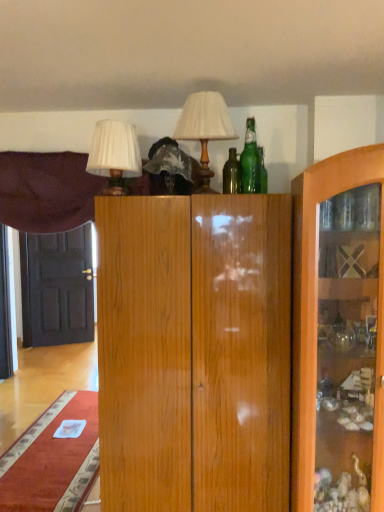
You are a GUI agent. You are given a task and a screenshot of the screen. Output one action in this format:
    pyautogui.click(x=<x>, y=<y>)
    Task: Click on the white pleated shade at upper left, which is the 2th table lamp from right to left
    Image resolution: width=384 pixels, height=512 pixels.
    Given the screenshot: What is the action you would take?
    pyautogui.click(x=114, y=154)

In order to face white pleated shade at upper left, which is the 2th table lamp from right to left, should I rotate leftwards or rightwards?

Rotate left and turn 10.356 degrees.

At what (x,y) coordinates should I click in order to perform the action: click on green glass bottle at upper center. Please return your answer as a coordinate pair (x, y). The image size is (384, 512). Looking at the image, I should click on (250, 161).

Where is `velvet purple curtain at upper left`? velvet purple curtain at upper left is located at coordinates (47, 191).

Is green glass bottle at upper center completely or partially outside of black glossy door at left?

green glass bottle at upper center is positioned outside black glossy door at left.

Does green glass bottle at upper center appear on the left side of black glossy door at left?

No.

Is green glass bottle at upper center turned away from black glossy door at left?

No, green glass bottle at upper center's orientation is not away from black glossy door at left.

Consider the image. Who is bigger, green glass bottle at upper center or black glossy door at left?

black glossy door at left is bigger.

Can you confirm if velvet purple curtain at upper left is taller than matte white lampshade at upper center, arranged as the 2th table lamp when viewed from the left?

Yes, velvet purple curtain at upper left is taller than matte white lampshade at upper center, arranged as the 2th table lamp when viewed from the left.

At what (x,y) coordinates should I click in order to perform the action: click on curtain lying on the left of matte white lampshade at upper center, arranged as the 2th table lamp when viewed from the left. Please return your answer as a coordinate pair (x, y). The width and height of the screenshot is (384, 512). Looking at the image, I should click on (47, 191).

From a real-world perspective, is velvet purple curtain at upper left positioned above or below matte white lampshade at upper center, arranged as the 2th table lamp when viewed from the left?

velvet purple curtain at upper left is below matte white lampshade at upper center, arranged as the 2th table lamp when viewed from the left.

Is point (197, 132) farther from viewer compared to point (247, 133)?

No, it is not.

Considering the relative positions of matte white lampshade at upper center, the 1th table lamp positioned from the right, and green glass bottle at upper center in the image provided, is matte white lampshade at upper center, the 1th table lamp positioned from the right, in front of green glass bottle at upper center?

Yes, matte white lampshade at upper center, the 1th table lamp positioned from the right, is closer to the camera.

In the image, there is a green glass bottle at upper center. Where is `table lamp above it (from the image's perspective)`? Image resolution: width=384 pixels, height=512 pixels. table lamp above it (from the image's perspective) is located at coordinates (204, 128).

How far apart are matte white lampshade at upper center, arranged as the 2th table lamp when viewed from the left, and green glass bottle at upper center?

They are 7.85 inches apart.

Is white pleated shade at upper left, which appears as the first table lamp when viewed from the left, bigger than green glass bottle at upper center?

Indeed, white pleated shade at upper left, which appears as the first table lamp when viewed from the left, has a larger size compared to green glass bottle at upper center.

At what (x,y) coordinates should I click in order to perform the action: click on bottle above the white pleated shade at upper left, which is the 2th table lamp from right to left (from the image's perspective). Please return your answer as a coordinate pair (x, y). This screenshot has height=512, width=384. Looking at the image, I should click on 250,161.

Which point is more forward, (134,148) or (252,152)?

Point (252,152)

From the picture: Relative to green glass bottle at upper center, is white pleated shade at upper left, which appears as the first table lamp when viewed from the left, in front or behind?

Clearly, white pleated shade at upper left, which appears as the first table lamp when viewed from the left, is in front of green glass bottle at upper center.

Measure the distance from matte white lampshade at upper center, arranged as the 2th table lamp when viewed from the left, to white pleated shade at upper left, which appears as the first table lamp when viewed from the left.

A distance of 12.54 inches exists between matte white lampshade at upper center, arranged as the 2th table lamp when viewed from the left, and white pleated shade at upper left, which appears as the first table lamp when viewed from the left.

Based on their sizes in the image, would you say matte white lampshade at upper center, the 1th table lamp positioned from the right, is bigger or smaller than white pleated shade at upper left, which appears as the first table lamp when viewed from the left?

In the image, matte white lampshade at upper center, the 1th table lamp positioned from the right, appears to be larger than white pleated shade at upper left, which appears as the first table lamp when viewed from the left.

From the image's perspective, is matte white lampshade at upper center, the 1th table lamp positioned from the right, above white pleated shade at upper left, which is the 2th table lamp from right to left?

Yes, from the image's perspective, matte white lampshade at upper center, the 1th table lamp positioned from the right, is over white pleated shade at upper left, which is the 2th table lamp from right to left.

Considering the sizes of objects matte white lampshade at upper center, the 1th table lamp positioned from the right, and white pleated shade at upper left, which appears as the first table lamp when viewed from the left, in the image provided, who is wider, matte white lampshade at upper center, the 1th table lamp positioned from the right, or white pleated shade at upper left, which appears as the first table lamp when viewed from the left,?

Wider between the two is matte white lampshade at upper center, the 1th table lamp positioned from the right.

Does green glass bottle at upper center appear on the right side of velvet purple curtain at upper left?

Indeed, green glass bottle at upper center is positioned on the right side of velvet purple curtain at upper left.

Who is more distant, green glass bottle at upper center or velvet purple curtain at upper left?

velvet purple curtain at upper left.

Considering the relative sizes of green glass bottle at upper center and velvet purple curtain at upper left in the image provided, is green glass bottle at upper center bigger than velvet purple curtain at upper left?

No, green glass bottle at upper center is not bigger than velvet purple curtain at upper left.

Looking at this image, measure the distance between white pleated shade at upper left, which is the 2th table lamp from right to left, and velvet purple curtain at upper left.

white pleated shade at upper left, which is the 2th table lamp from right to left, and velvet purple curtain at upper left are 47.60 centimeters apart.

Does white pleated shade at upper left, which appears as the first table lamp when viewed from the left, come behind velvet purple curtain at upper left?

That is False.

Is white pleated shade at upper left, which is the 2th table lamp from right to left, in contact with velvet purple curtain at upper left?

No, white pleated shade at upper left, which is the 2th table lamp from right to left, is not making contact with velvet purple curtain at upper left.

Which is more to the left, white pleated shade at upper left, which is the 2th table lamp from right to left, or velvet purple curtain at upper left?

Positioned to the left is velvet purple curtain at upper left.

Where is `door below the green glass bottle at upper center (from the image's perspective)`? This screenshot has width=384, height=512. door below the green glass bottle at upper center (from the image's perspective) is located at coordinates (57, 287).

From the image's perspective, starting from the velvet purple curtain at upper left, which table lamp is the 2nd one above? Please provide its 2D coordinates.

[(204, 128)]

Based on their spatial positions, is black glossy door at left or white pleated shade at upper left, which is the 2th table lamp from right to left, closer to matte white lampshade at upper center, the 1th table lamp positioned from the right?

The object closer to matte white lampshade at upper center, the 1th table lamp positioned from the right, is white pleated shade at upper left, which is the 2th table lamp from right to left.

Based on their spatial positions, is velvet purple curtain at upper left or white pleated shade at upper left, which is the 2th table lamp from right to left, closer to black glossy door at left?

velvet purple curtain at upper left is closer to black glossy door at left.

From the image, which object appears to be farther from white pleated shade at upper left, which appears as the first table lamp when viewed from the left, green glass bottle at upper center or matte white lampshade at upper center, arranged as the 2th table lamp when viewed from the left?

green glass bottle at upper center.

Looking at the image, which one is located further to white pleated shade at upper left, which is the 2th table lamp from right to left, velvet purple curtain at upper left or black glossy door at left?

black glossy door at left is positioned further to the anchor white pleated shade at upper left, which is the 2th table lamp from right to left.

Based on the photo, which object lies nearer to the anchor point white pleated shade at upper left, which is the 2th table lamp from right to left, black glossy door at left or velvet purple curtain at upper left?

Among the two, velvet purple curtain at upper left is located nearer to white pleated shade at upper left, which is the 2th table lamp from right to left.

When comparing their distances from black glossy door at left, does matte white lampshade at upper center, arranged as the 2th table lamp when viewed from the left, or velvet purple curtain at upper left seem closer?

velvet purple curtain at upper left is closer to black glossy door at left.

Based on their spatial positions, is green glass bottle at upper center or white pleated shade at upper left, which is the 2th table lamp from right to left, closer to matte white lampshade at upper center, arranged as the 2th table lamp when viewed from the left?

green glass bottle at upper center.

When comparing their distances from velvet purple curtain at upper left, does white pleated shade at upper left, which appears as the first table lamp when viewed from the left, or matte white lampshade at upper center, the 1th table lamp positioned from the right, seem further?

matte white lampshade at upper center, the 1th table lamp positioned from the right.

Where is `table lamp between velvet purple curtain at upper left and matte white lampshade at upper center, arranged as the 2th table lamp when viewed from the left, in the horizontal direction`? The width and height of the screenshot is (384, 512). table lamp between velvet purple curtain at upper left and matte white lampshade at upper center, arranged as the 2th table lamp when viewed from the left, in the horizontal direction is located at coordinates (114, 154).

This screenshot has width=384, height=512. What are the coordinates of `curtain located between green glass bottle at upper center and black glossy door at left in the depth direction` in the screenshot? It's located at (47, 191).

This screenshot has width=384, height=512. Find the location of `curtain positioned between white pleated shade at upper left, which is the 2th table lamp from right to left, and black glossy door at left from near to far`. curtain positioned between white pleated shade at upper left, which is the 2th table lamp from right to left, and black glossy door at left from near to far is located at coordinates (47, 191).

Identify the location of bottle between matte white lampshade at upper center, the 1th table lamp positioned from the right, and black glossy door at left, along the z-axis. This screenshot has height=512, width=384. (250, 161).